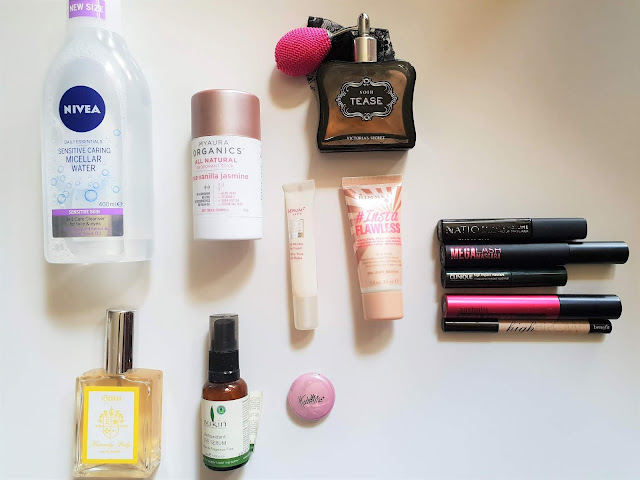
Locate an element on the screen. This screenshot has height=480, width=640. bottle is located at coordinates (109, 206).